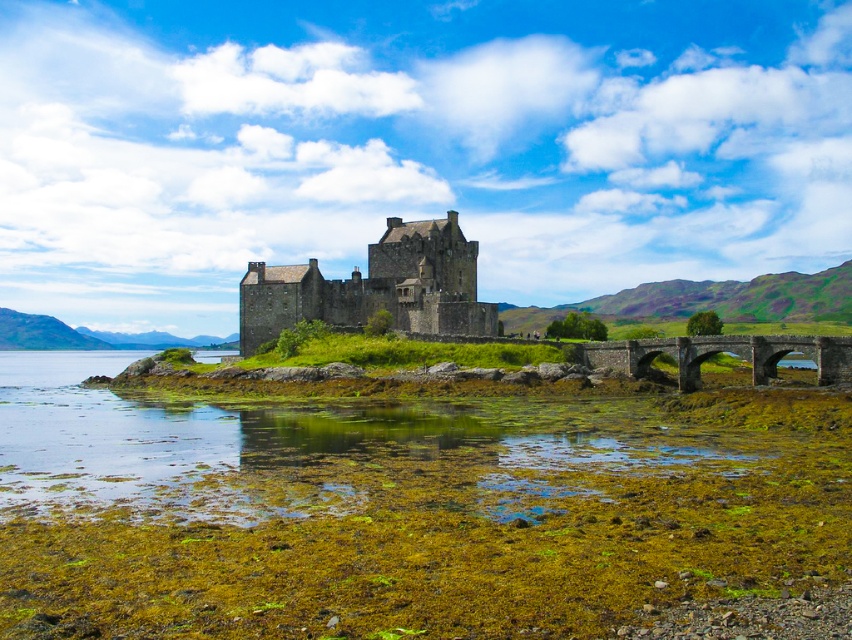
Does green mossy water at lower center have a greater width compared to stone arch bridge at center?

Yes, green mossy water at lower center is wider than stone arch bridge at center.

Describe the element at coordinates (292, 445) in the screenshot. The height and width of the screenshot is (640, 852). I see `green mossy water at lower center` at that location.

What do you see at coordinates (292, 445) in the screenshot?
I see `green mossy water at lower center` at bounding box center [292, 445].

At what (x,y) coordinates should I click in order to perform the action: click on green mossy water at lower center. Please return your answer as a coordinate pair (x, y). The width and height of the screenshot is (852, 640). Looking at the image, I should click on (292, 445).

Is brown stone castle at center shorter than stone arch bridge at center?

Incorrect, brown stone castle at center's height does not fall short of stone arch bridge at center's.

Who is more forward, (410, 260) or (799, 344)?

Point (799, 344) is in front.

This screenshot has width=852, height=640. What do you see at coordinates (375, 288) in the screenshot?
I see `brown stone castle at center` at bounding box center [375, 288].

The height and width of the screenshot is (640, 852). What are the coordinates of `brown stone castle at center` in the screenshot? It's located at (375, 288).

Can you confirm if green mossy water at lower center is bigger than brown stone castle at center?

Yes.

In order to click on green mossy water at lower center in this screenshot , I will do `click(292, 445)`.

At what (x,y) coordinates should I click in order to perform the action: click on green mossy water at lower center. Please return your answer as a coordinate pair (x, y). Looking at the image, I should click on (292, 445).